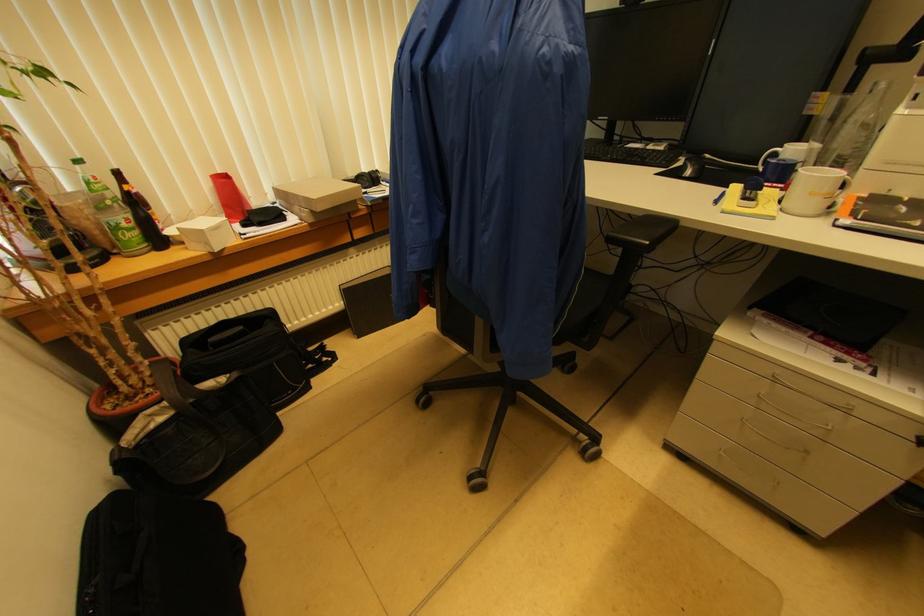
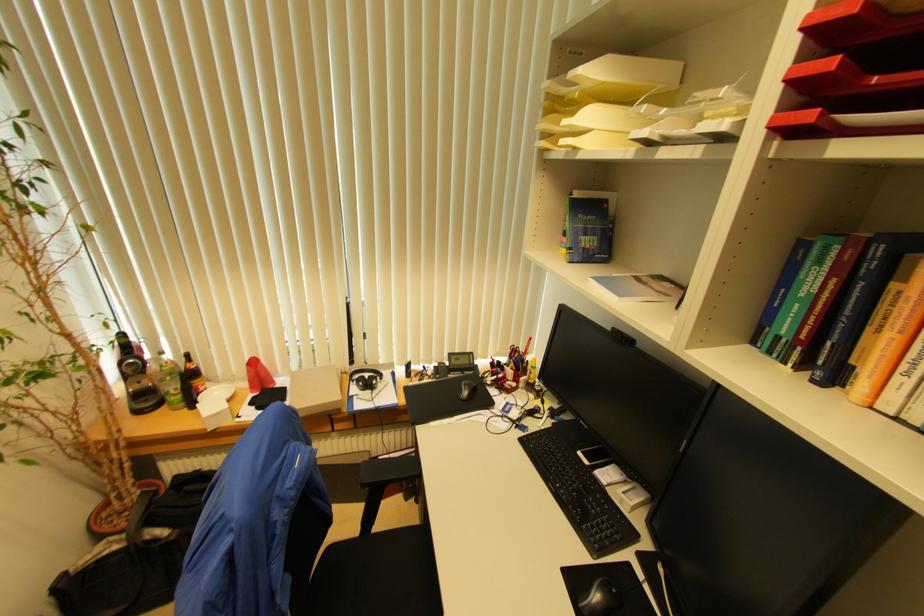
The point at (373,177) is marked in the first image. Where is the corresponding point in the second image?

(371, 384)